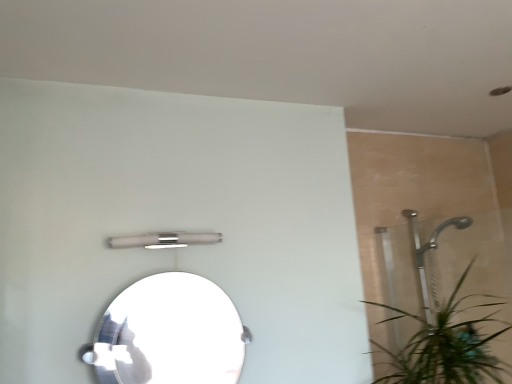
Identify the location of satin nickel light fixture at upper center. Image resolution: width=512 pixels, height=384 pixels. (163, 240).

What do you see at coordinates (163, 240) in the screenshot?
I see `satin nickel light fixture at upper center` at bounding box center [163, 240].

Measure the distance between clear glass mirror at center and camera.

clear glass mirror at center is 4.45 feet from camera.

Where is `clear glass mirror at center`? clear glass mirror at center is located at coordinates pyautogui.click(x=170, y=333).

This screenshot has height=384, width=512. Describe the element at coordinates (170, 333) in the screenshot. I see `clear glass mirror at center` at that location.

What are the coordinates of `satin nickel light fixture at upper center` in the screenshot? It's located at (163, 240).

In the scene shown: Which is more to the left, clear glass mirror at center or satin nickel light fixture at upper center?

satin nickel light fixture at upper center.

Looking at this image, which object is more forward, clear glass mirror at center or satin nickel light fixture at upper center?

clear glass mirror at center is in front.

Which is nearer, (169, 290) or (112, 240)?

Point (169, 290) is closer to the camera than point (112, 240).

From the image's perspective, is clear glass mirror at center above or below satin nickel light fixture at upper center?

clear glass mirror at center is situated lower than satin nickel light fixture at upper center in the image.

From a real-world perspective, which object stands above the other?

satin nickel light fixture at upper center.

Is clear glass mirror at center thinner than satin nickel light fixture at upper center?

No.

Consider the image. Considering the sizes of clear glass mirror at center and satin nickel light fixture at upper center in the image, is clear glass mirror at center taller or shorter than satin nickel light fixture at upper center?

Clearly, clear glass mirror at center is taller compared to satin nickel light fixture at upper center.

Between clear glass mirror at center and satin nickel light fixture at upper center, which one has larger size?

With larger size is clear glass mirror at center.

Which is correct: clear glass mirror at center is inside satin nickel light fixture at upper center, or outside of it?

clear glass mirror at center exists outside the volume of satin nickel light fixture at upper center.

Is clear glass mirror at center not close to satin nickel light fixture at upper center?

No, clear glass mirror at center is not far from satin nickel light fixture at upper center.

Could you tell me if clear glass mirror at center is turned towards satin nickel light fixture at upper center?

No, clear glass mirror at center is not aimed at satin nickel light fixture at upper center.

How many degrees apart are the facing directions of clear glass mirror at center and satin nickel light fixture at upper center?

The facing directions of clear glass mirror at center and satin nickel light fixture at upper center are 0.662 degrees apart.

Where is `mirror on the right of the satin nickel light fixture at upper center`? Image resolution: width=512 pixels, height=384 pixels. mirror on the right of the satin nickel light fixture at upper center is located at coordinates (170, 333).

Can you confirm if satin nickel light fixture at upper center is positioned to the right of clear glass mirror at center?

No.

Which is behind, satin nickel light fixture at upper center or clear glass mirror at center?

satin nickel light fixture at upper center is further away from the camera.

Which point is more distant from viewer, (x=165, y=245) or (x=192, y=374)?

Result: The point (x=165, y=245) is farther from the camera.

From the image's perspective, which one is positioned lower, satin nickel light fixture at upper center or clear glass mirror at center?

From the image's view, clear glass mirror at center is below.

From a real-world perspective, is satin nickel light fixture at upper center beneath clear glass mirror at center?

Actually, satin nickel light fixture at upper center is physically above clear glass mirror at center in the real world.

Which object is wider, satin nickel light fixture at upper center or clear glass mirror at center?

clear glass mirror at center.

Considering the sizes of satin nickel light fixture at upper center and clear glass mirror at center in the image, is satin nickel light fixture at upper center taller or shorter than clear glass mirror at center?

Clearly, satin nickel light fixture at upper center is shorter compared to clear glass mirror at center.

Looking at the image, does satin nickel light fixture at upper center seem bigger or smaller compared to clear glass mirror at center?

In the image, satin nickel light fixture at upper center appears to be smaller than clear glass mirror at center.

Consider the image. Is satin nickel light fixture at upper center surrounding clear glass mirror at center?

No, clear glass mirror at center is not inside satin nickel light fixture at upper center.

Is satin nickel light fixture at upper center touching clear glass mirror at center?

No, satin nickel light fixture at upper center is not next to clear glass mirror at center.

Is satin nickel light fixture at upper center turned away from clear glass mirror at center?

satin nickel light fixture at upper center does not have its back to clear glass mirror at center.

Find the location of `light fixture above the clear glass mirror at center (from a real-world perspective)`. light fixture above the clear glass mirror at center (from a real-world perspective) is located at coordinates (163, 240).

Locate an element on the screen. light fixture behind the clear glass mirror at center is located at coordinates (163, 240).

Locate an element on the screen. This screenshot has width=512, height=384. mirror on the right of the satin nickel light fixture at upper center is located at coordinates (170, 333).